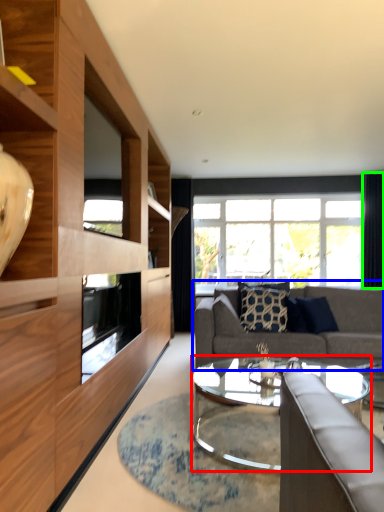
Question: Based on their relative distances, which object is nearer to coffee table (highlighted by a red box)? Choose from studio couch (highlighted by a blue box) and curtain (highlighted by a green box).

Choices:
 (A) studio couch
 (B) curtain

Answer: (A)